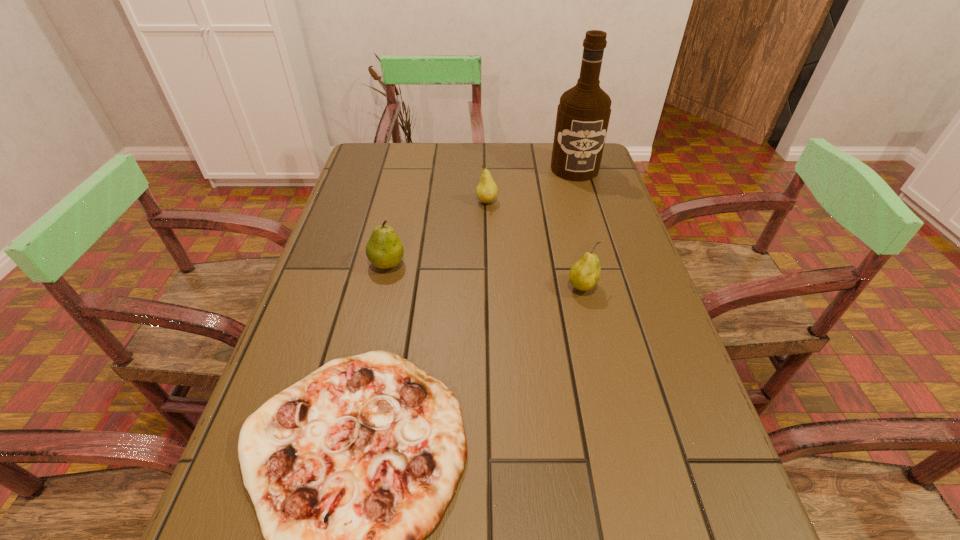
Image resolution: width=960 pixels, height=540 pixels. Find the location of `free space between the farthest object and the rightmost pear`. free space between the farthest object and the rightmost pear is located at coordinates (578, 228).

This screenshot has height=540, width=960. In order to click on vacant point located between the leftmost pear and the second pear from left to right in this screenshot , I will do `click(437, 233)`.

Image resolution: width=960 pixels, height=540 pixels. What are the coordinates of `free spot between the leftmost pear and the rightmost pear` in the screenshot? It's located at 485,275.

Identify the location of free space between the alcohol and the leftmost pear. (481, 217).

Identify the location of free spot between the farthest pear and the rightmost pear. (535, 245).

Locate which object is the third closest to the second farthest object. Please provide its 2D coordinates. Your answer should be formatted as a tuple, i.e. [(x, y)], where the tuple contains the x and y coordinates of a point satisfying the conditions above.

[(584, 274)]

This screenshot has width=960, height=540. I want to click on object identified as the closest to the rightmost pear, so click(x=349, y=469).

Identify the location of pear that can be found as the second closest to the rightmost pear. The image size is (960, 540). (384, 249).

Identify the location of pear that stands as the closest to the third object from left to right. The image size is (960, 540). (384, 249).